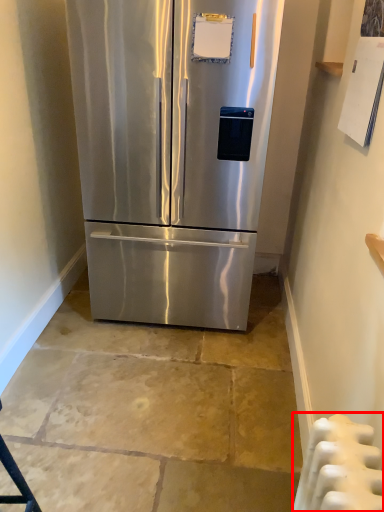
Question: From the image's perspective, where is radiator (annotated by the red box) located in relation to refrigerator in the image?

Choices:
 (A) below
 (B) above

Answer: (A)